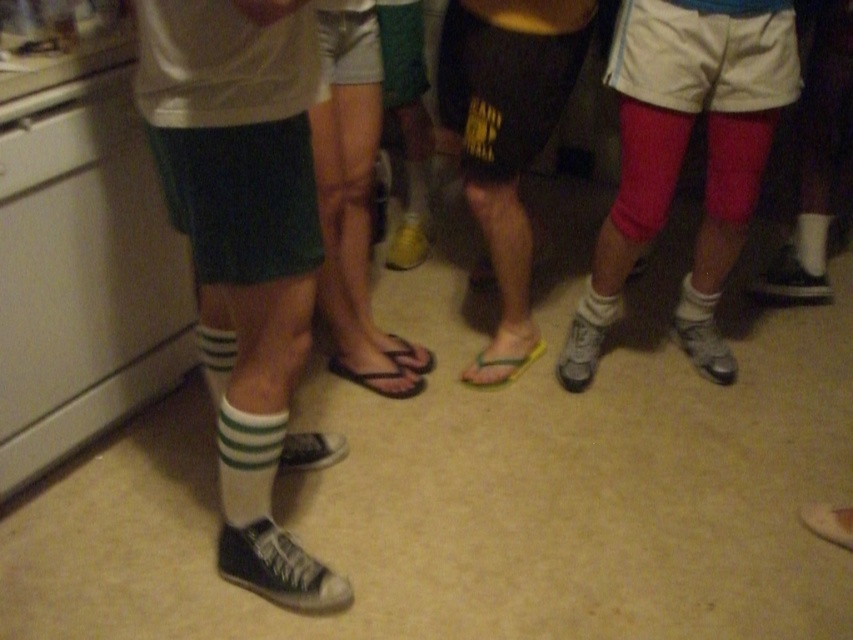
You are standing in the room and want to determine which of the two points, point (231, 550) or point (495, 4), is nearer to you. Based on the scene description, which point is closer?

Point (231, 550) is closer to the camera than point (495, 4), so it is the nearer one.